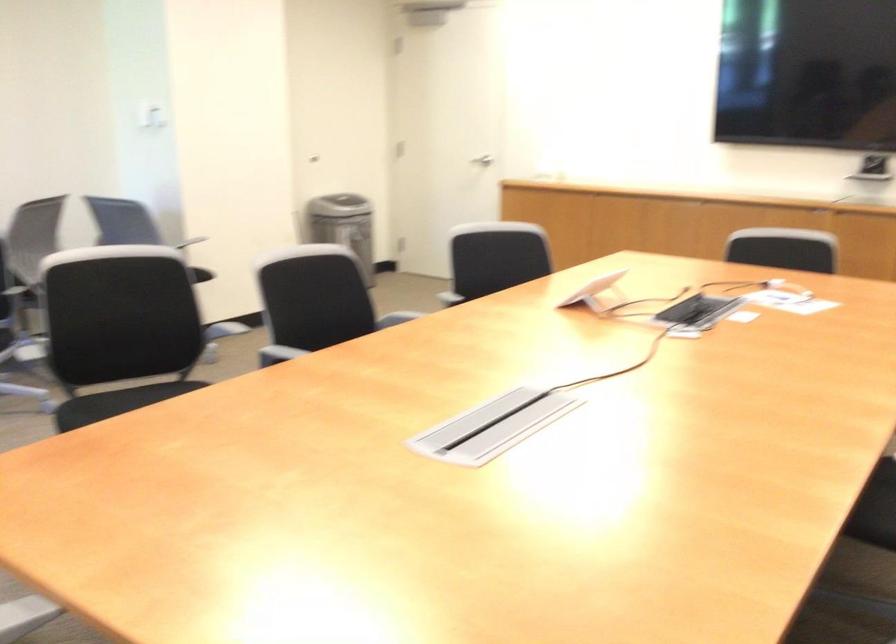
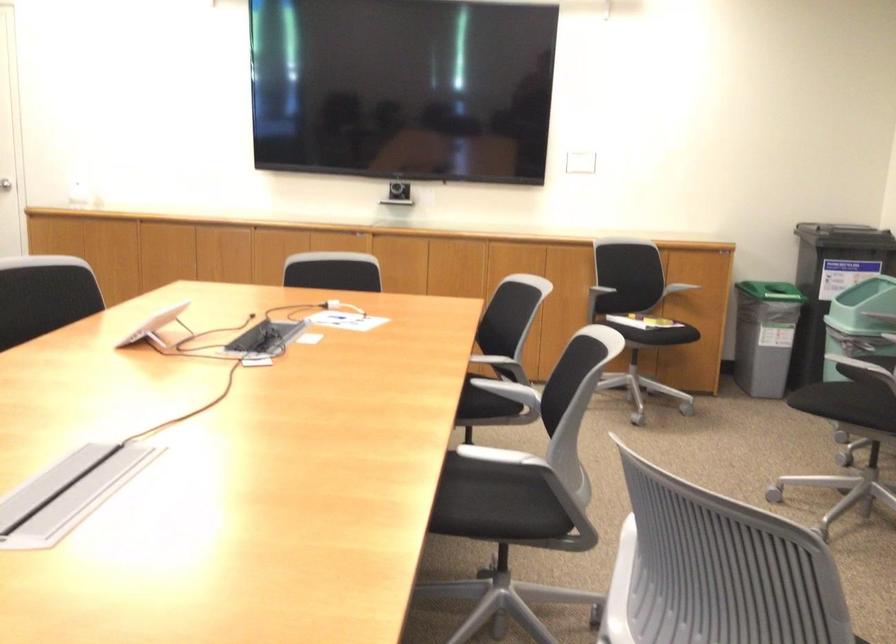
Locate, in the second image, the point that corresponds to [778,243] in the first image.

(332, 272)